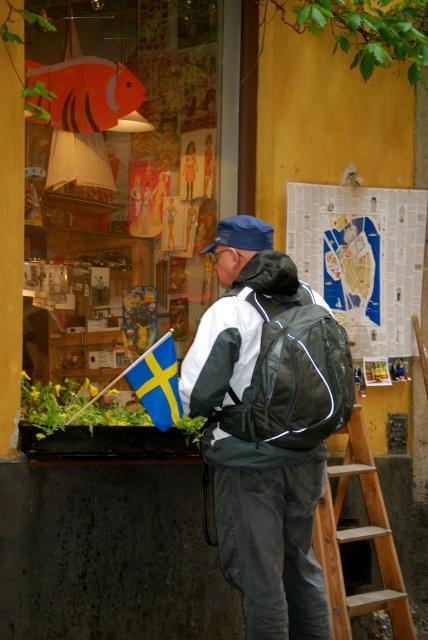
You are a tourist holding a white paper map at upper right and a white matte jacket at center. You want to know which item is wider. Which one is wider?

The white paper map at upper right is wider than the white matte jacket at center because its width surpasses the jacket.

You are a delivery person who needs to hand over a package to the man in the scene. You are standing at the entrance of the shop, facing the man. The package is too large to fit in your hands, so you need to place it on either the white paper map at upper right or the white matte jacket at center. However, you must choose the surface that is closer to the man to ensure he can easily reach it. Which surface should you choose?

The white matte jacket at center is closer to the man than the white paper map at upper right, so you should place the package on the white matte jacket at center.